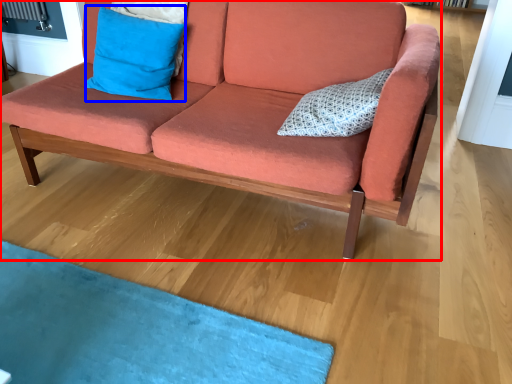
Question: Which object appears closest to the camera in this image, studio couch (highlighted by a red box) or pillow (highlighted by a blue box)?

Choices:
 (A) studio couch
 (B) pillow

Answer: (A)